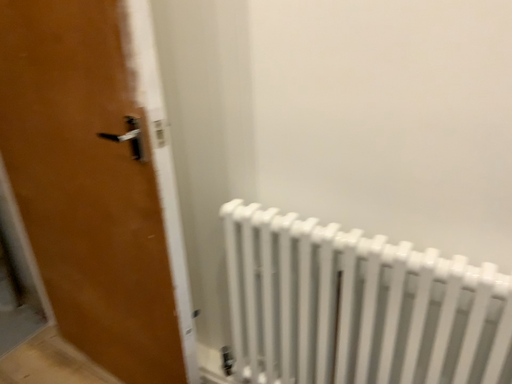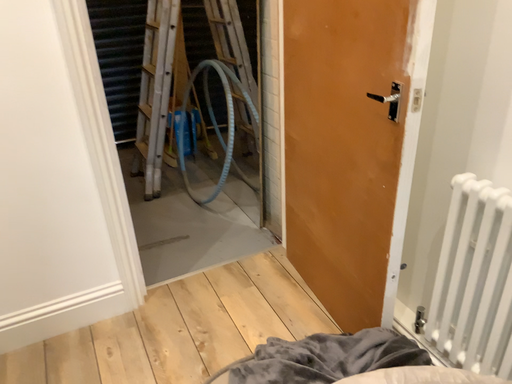
Question: Which way did the camera rotate in the video?

Choices:
 (A) rotated right
 (B) rotated left

Answer: (B)